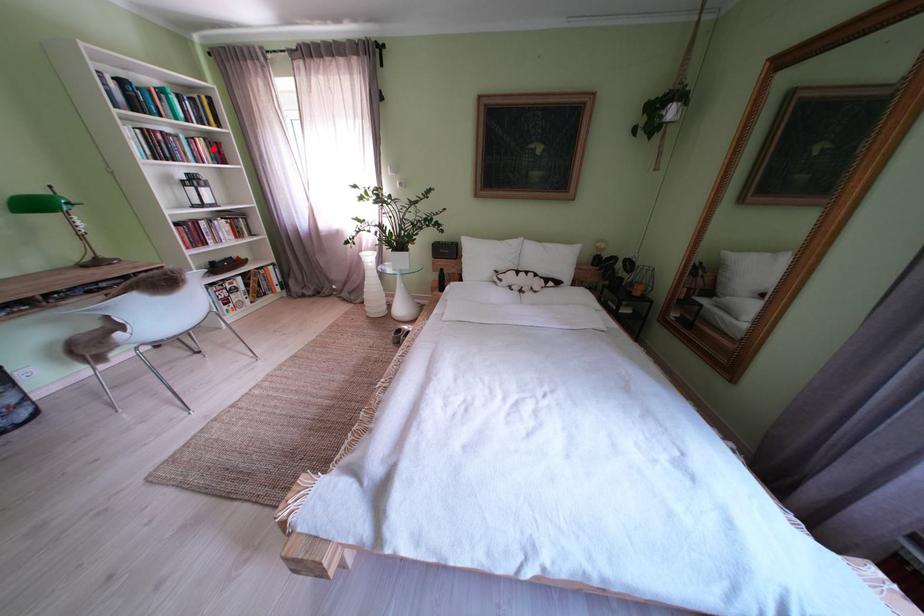
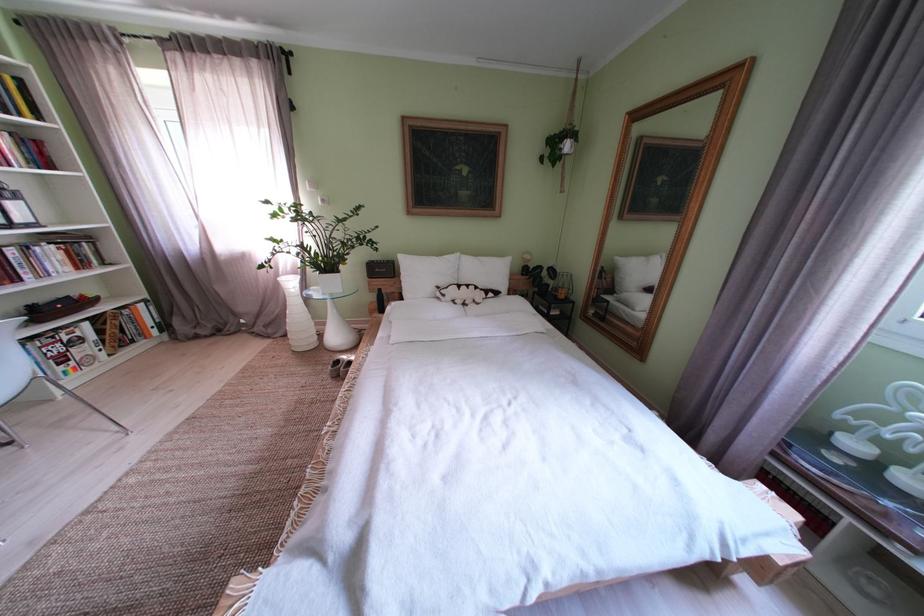
Question: A red point is marked in image1. In image2, is the corresponding 3D point closer to the camera or farther? Reply with the corresponding letter.

Choices:
 (A) The corresponding 3D point is closer.
 (B) The corresponding 3D point is farther.

Answer: (B)